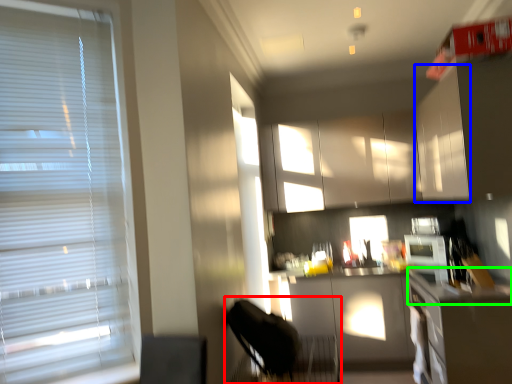
Question: Which object is the farthest from swivel chair (highlighted by a red box)? Choose among these: cabinetry (highlighted by a blue box) or counter top (highlighted by a green box).

Choices:
 (A) cabinetry
 (B) counter top

Answer: (A)